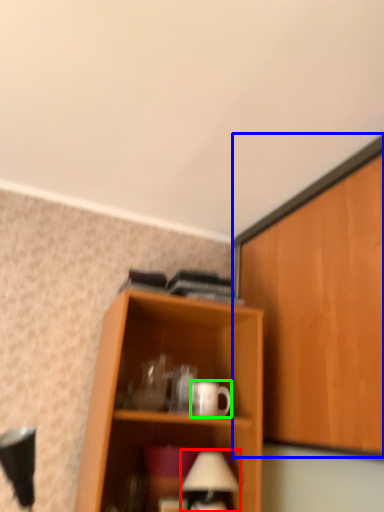
Question: Which is nearer to the table lamp (highlighted by a red box)? cabinetry (highlighted by a blue box) or mug (highlighted by a green box).

Choices:
 (A) cabinetry
 (B) mug

Answer: (B)